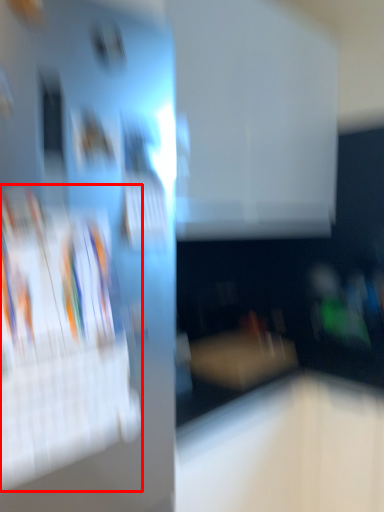
Question: From the image's perspective, where is magazine (annotated by the red box) located in relation to furniture in the image?

Choices:
 (A) below
 (B) above

Answer: (B)